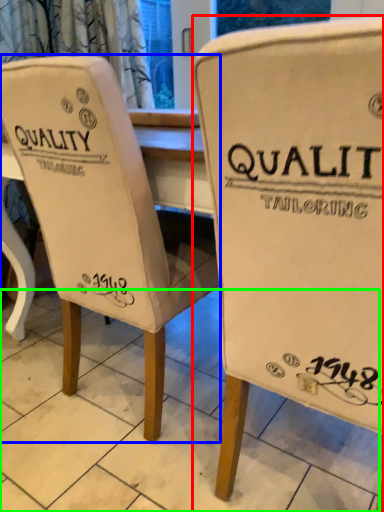
Question: Estimate the real-world distances between objects in this image. Which object is farther from chair (highlighted by a red box), chair (highlighted by a blue box) or tile (highlighted by a green box)?

Choices:
 (A) chair
 (B) tile

Answer: (B)